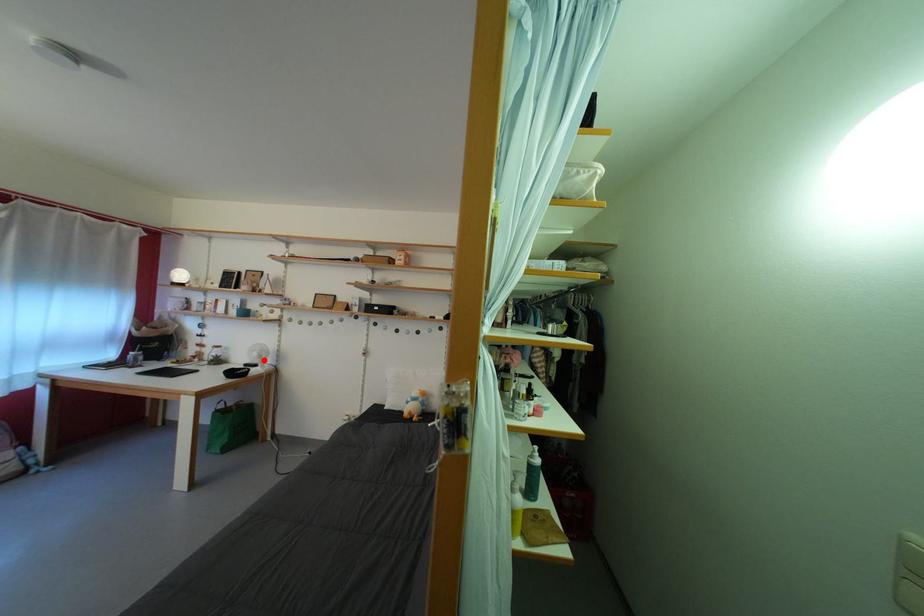
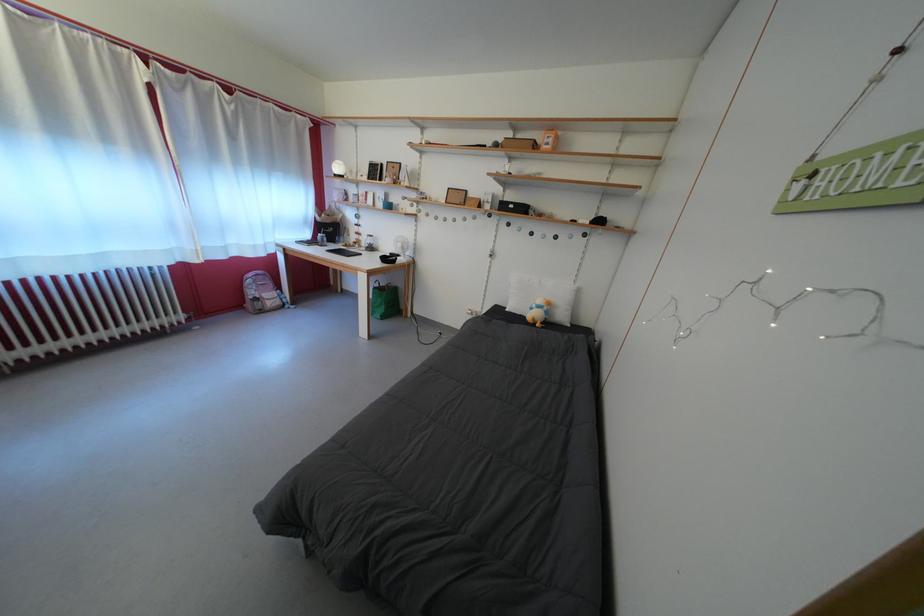
Find the pixel in the second image that matches the highlighted location in the first image.

(407, 251)